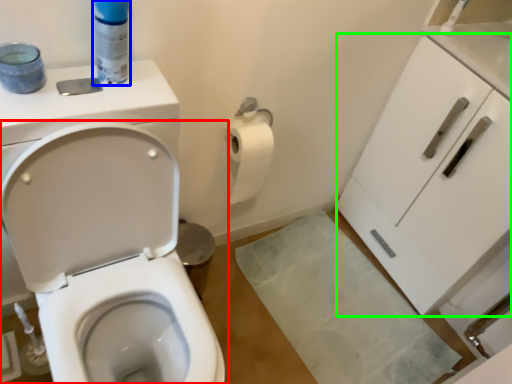
Question: Based on their relative distances, which object is nearer to toilet (highlighted by a red box)? Choose from cleaning product (highlighted by a blue box) and cabinetry (highlighted by a green box).

Choices:
 (A) cleaning product
 (B) cabinetry

Answer: (A)